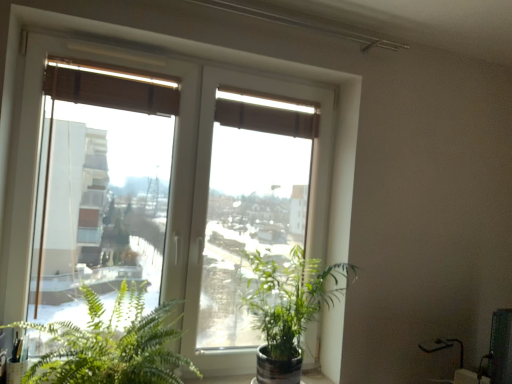
Question: Is green leafy plant at lower left, the second houseplant viewed from the right, wider than brown fabric curtain at upper center?

Choices:
 (A) no
 (B) yes

Answer: (B)

Question: From a real-world perspective, is green leafy plant at lower left, positioned as the first houseplant in left-to-right order, positioned under brown fabric curtain at upper center based on gravity?

Choices:
 (A) no
 (B) yes

Answer: (B)

Question: Is the position of green leafy plant at lower left, positioned as the first houseplant in left-to-right order, more distant than that of brown fabric curtain at upper center?

Choices:
 (A) no
 (B) yes

Answer: (A)

Question: Would you say green leafy plant at lower left, the second houseplant viewed from the right, contains brown fabric curtain at upper center?

Choices:
 (A) no
 (B) yes

Answer: (A)

Question: From a real-world perspective, is green leafy plant at lower left, positioned as the first houseplant in left-to-right order, on top of brown fabric curtain at upper center?

Choices:
 (A) no
 (B) yes

Answer: (A)

Question: Does transparent glass window at center appear on the right side of brown fabric curtain at upper center?

Choices:
 (A) no
 (B) yes

Answer: (A)

Question: Is transparent glass window at center aimed at brown fabric curtain at upper center?

Choices:
 (A) yes
 (B) no

Answer: (A)

Question: Is transparent glass window at center oriented away from brown fabric curtain at upper center?

Choices:
 (A) yes
 (B) no

Answer: (A)

Question: Is the position of transparent glass window at center less distant than that of brown fabric curtain at upper center?

Choices:
 (A) no
 (B) yes

Answer: (B)

Question: Considering the relative positions of transparent glass window at center and brown fabric curtain at upper center in the image provided, is transparent glass window at center to the left of brown fabric curtain at upper center from the viewer's perspective?

Choices:
 (A) no
 (B) yes

Answer: (B)

Question: From the image's perspective, is transparent glass window at center below brown fabric curtain at upper center?

Choices:
 (A) yes
 (B) no

Answer: (A)

Question: Can you confirm if green leafy plant at lower left, the second houseplant viewed from the right, is wider than transparent glass window at center?

Choices:
 (A) yes
 (B) no

Answer: (A)